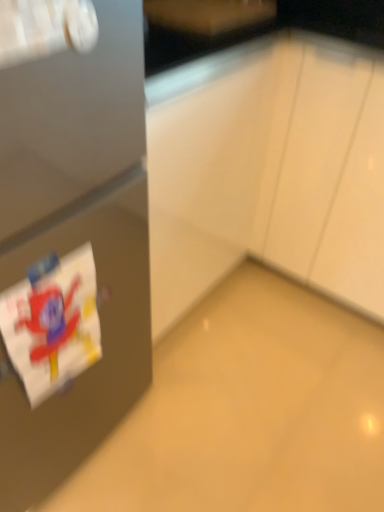
Locate an element on the screen. satin silver door handle at upper left is located at coordinates (45, 28).

Measure the distance between satin silver door handle at upper left and camera.

satin silver door handle at upper left and camera are 19.02 inches apart.

Measure the distance between point (x=88, y=17) and camera.

The depth of point (x=88, y=17) is 22.56 inches.

What do you see at coordinates (45, 28) in the screenshot? This screenshot has width=384, height=512. I see `satin silver door handle at upper left` at bounding box center [45, 28].

In order to face satin silver door handle at upper left, should I rotate leftwards or rightwards?

To face it directly, rotate left by 34.754 degrees.

Identify the location of satin silver door handle at upper left. (45, 28).